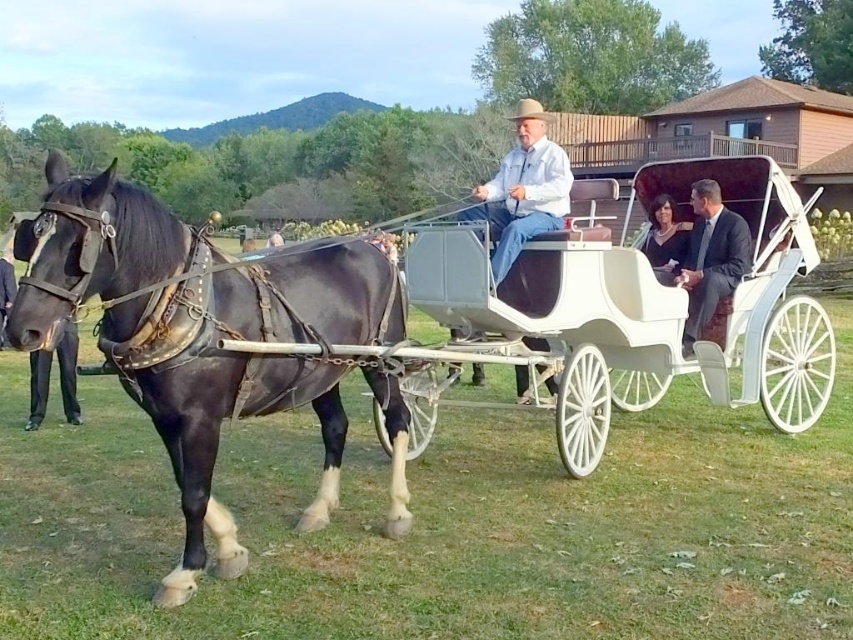
In the scene shown: Which is more to the right, shiny black horse at left or dark gray suit at center?

From the viewer's perspective, dark gray suit at center appears more on the right side.

Is shiny black horse at left positioned before dark gray suit at center?

Yes, it is in front of dark gray suit at center.

This screenshot has width=853, height=640. In order to click on shiny black horse at left in this screenshot , I will do `click(201, 332)`.

Does light brown leather hat at center appear under black satin dress at center?

Actually, light brown leather hat at center is above black satin dress at center.

Does point (535, 216) lie behind point (688, 228)?

No, (535, 216) is closer to viewer.

Where is `light brown leather hat at center`? light brown leather hat at center is located at coordinates (523, 189).

Which is above, shiny black horse at left or black satin dress at center?

black satin dress at center is above.

Is point (67, 289) closer to viewer compared to point (657, 218)?

Yes, it is.

Which is behind, point (80, 285) or point (660, 264)?

The point (660, 264) is more distant.

Locate an element on the screen. This screenshot has height=640, width=853. shiny black horse at left is located at coordinates (201, 332).